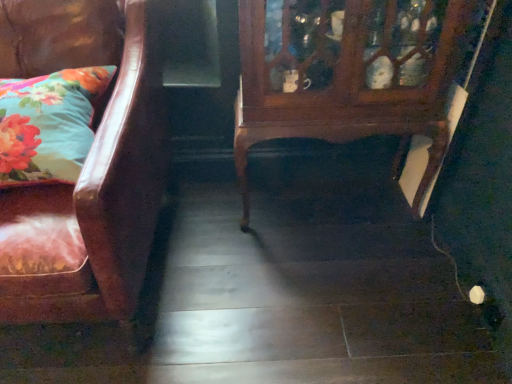
Where is `vacant area in front of wooden cabinet at center`? vacant area in front of wooden cabinet at center is located at coordinates (338, 291).